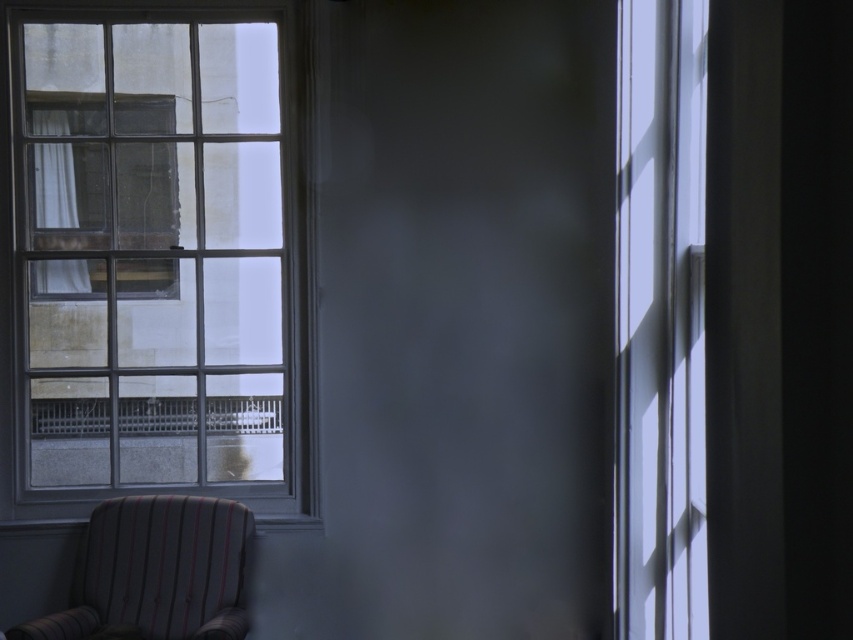
Question: Can you confirm if transparent glass window at right is positioned above striped fabric armchair at lower left?

Choices:
 (A) no
 (B) yes

Answer: (B)

Question: Which of the following is the farthest from the observer?

Choices:
 (A) transparent glass window at right
 (B) clear glass window at left
 (C) striped fabric armchair at lower left

Answer: (B)

Question: Is clear glass window at left bigger than striped fabric armchair at lower left?

Choices:
 (A) no
 (B) yes

Answer: (B)

Question: Estimate the real-world distances between objects in this image. Which object is farther from the transparent glass window at right?

Choices:
 (A) striped fabric armchair at lower left
 (B) clear glass window at left

Answer: (B)

Question: Among these objects, which one is nearest to the camera?

Choices:
 (A) transparent glass window at right
 (B) clear glass window at left

Answer: (A)

Question: Can you confirm if clear glass window at left is positioned above striped fabric armchair at lower left?

Choices:
 (A) yes
 (B) no

Answer: (A)